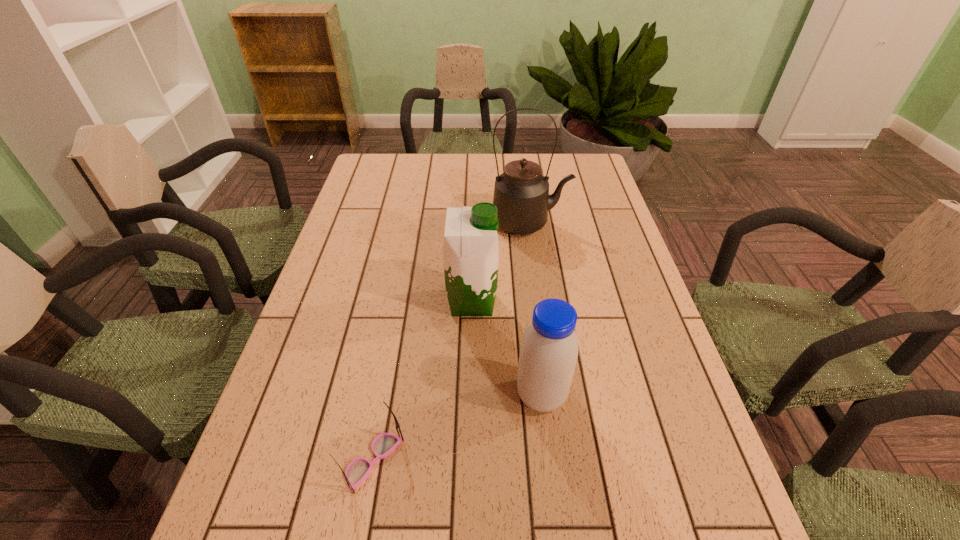
Where is `free space between the tallest object and the second farthest object`? Image resolution: width=960 pixels, height=540 pixels. free space between the tallest object and the second farthest object is located at coordinates (501, 262).

Where is `vacant space that's between the farther soya milk and the third farthest object`? The image size is (960, 540). vacant space that's between the farther soya milk and the third farthest object is located at coordinates (507, 349).

The height and width of the screenshot is (540, 960). I want to click on free point between the left soya milk and the shortest object, so click(422, 381).

What are the coordinates of `vacant area that lies between the left soya milk and the farthest object` in the screenshot? It's located at (501, 262).

Locate an element on the screen. The image size is (960, 540). object that stands as the third closest to the shortest object is located at coordinates (521, 194).

Choose which object is the third nearest neighbor to the nearest object. Please provide its 2D coordinates. Your answer should be formatted as a tuple, i.e. [(x, y)], where the tuple contains the x and y coordinates of a point satisfying the conditions above.

[(521, 194)]

Locate an element on the screen. free space that satisfies the following two spatial constraints: 1. on the front-facing side of the right soya milk; 2. on the right side of the farther soya milk is located at coordinates (470, 396).

At what (x,y) coordinates should I click in order to perform the action: click on free point that satisfies the following two spatial constraints: 1. on the back side of the third farthest object; 2. on the right side of the spectacles. Please return your answer as a coordinate pair (x, y). Looking at the image, I should click on (385, 396).

This screenshot has width=960, height=540. I want to click on vacant region that satisfies the following two spatial constraints: 1. on the front-facing side of the third nearest object; 2. on the left side of the nearer soya milk, so click(x=470, y=396).

This screenshot has height=540, width=960. I want to click on vacant space that satisfies the following two spatial constraints: 1. on the front-facing side of the left soya milk; 2. on the right side of the third farthest object, so click(470, 396).